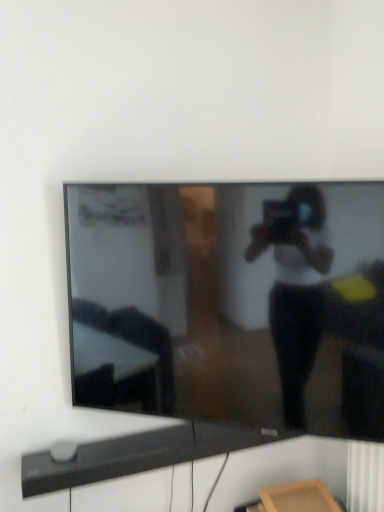
Question: Is black glossy tv at center bigger or smaller than black matte soundbar at lower center?

Choices:
 (A) big
 (B) small

Answer: (A)

Question: Does point (312, 224) appear closer or farther from the camera than point (142, 432)?

Choices:
 (A) farther
 (B) closer

Answer: (B)

Question: From a real-world perspective, relative to black matte soundbar at lower center, is black glossy tv at center vertically above or below?

Choices:
 (A) below
 (B) above

Answer: (B)

Question: From a real-world perspective, is black matte soundbar at lower center positioned above or below black glossy tv at center?

Choices:
 (A) below
 (B) above

Answer: (A)

Question: Is point (226, 428) closer or farther from the camera than point (344, 230)?

Choices:
 (A) farther
 (B) closer

Answer: (A)

Question: Is black matte soundbar at lower center inside or outside of black glossy tv at center?

Choices:
 (A) inside
 (B) outside

Answer: (B)

Question: Is black matte soundbar at lower center to the left or to the right of black glossy tv at center in the image?

Choices:
 (A) right
 (B) left

Answer: (B)